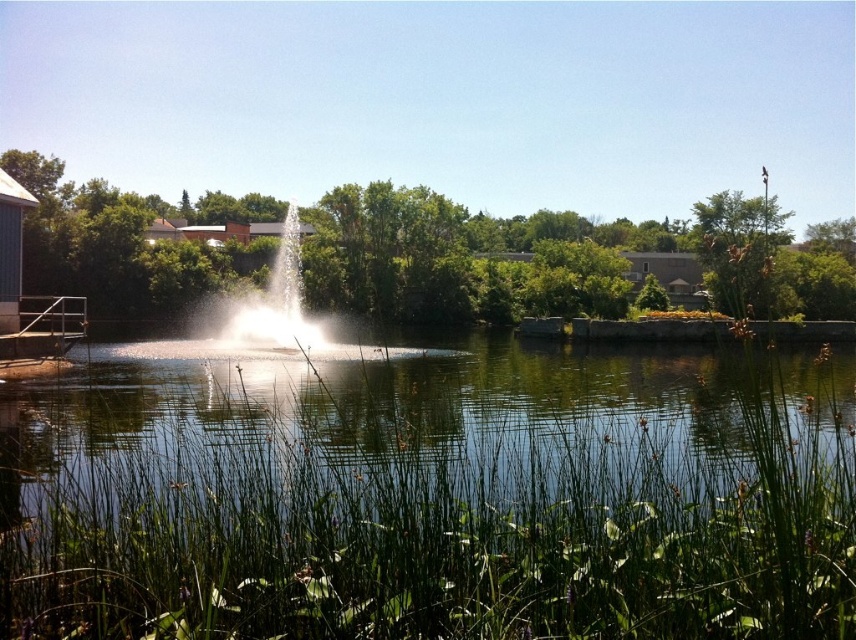
You are standing at the edge of the pond and want to locate the clear water at center. According to the coordinates provided, where should you look relative to the fountain?

The clear water at center is located at coordinates point [397,422], which means it is positioned to the right and slightly above the fountain.

You are standing at the edge of the pond and want to reach the clear water at center located at point (x=397, y=422). Is there any obstacle between your current position and the clear water at center?

There are tall reeds and aquatic plants in the foreground which may obstruct the path to the clear water at center located at point (x=397, y=422).